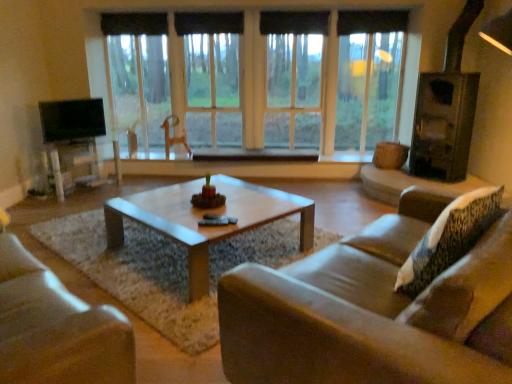
Question: Could you tell me if matte white entertainment center at left is facing leather couch at lower left, placed as the second studio couch when sorted from right to left?

Choices:
 (A) yes
 (B) no

Answer: (B)

Question: Can leather couch at lower left, the first studio couch viewed from the left, be found inside matte white entertainment center at left?

Choices:
 (A) yes
 (B) no

Answer: (B)

Question: Can you confirm if matte white entertainment center at left is thinner than leather couch at lower left, the first studio couch viewed from the left?

Choices:
 (A) yes
 (B) no

Answer: (B)

Question: Does matte white entertainment center at left have a smaller size compared to leather couch at lower left, the first studio couch viewed from the left?

Choices:
 (A) no
 (B) yes

Answer: (B)

Question: Can you confirm if matte white entertainment center at left is bigger than leather couch at lower left, placed as the second studio couch when sorted from right to left?

Choices:
 (A) no
 (B) yes

Answer: (A)

Question: Based on their sizes in the image, would you say transparent glass window at center is bigger or smaller than brown leather couch at center, which appears as the first studio couch when viewed from the right?

Choices:
 (A) big
 (B) small

Answer: (B)

Question: Choose the correct answer: Is transparent glass window at center inside brown leather couch at center, positioned as the 2th studio couch in left-to-right order, or outside it?

Choices:
 (A) inside
 (B) outside

Answer: (B)

Question: Relative to brown leather couch at center, positioned as the 2th studio couch in left-to-right order, is transparent glass window at center in front or behind?

Choices:
 (A) front
 (B) behind

Answer: (B)

Question: Considering the positions of point (253, 59) and point (303, 304), is point (253, 59) closer or farther from the camera than point (303, 304)?

Choices:
 (A) farther
 (B) closer

Answer: (A)

Question: Based on their sizes in the image, would you say brown leather couch at center, which appears as the first studio couch when viewed from the right, is bigger or smaller than black fabric curtain at upper center, the second curtain in the right-to-left sequence?

Choices:
 (A) big
 (B) small

Answer: (A)

Question: Choose the correct answer: Is brown leather couch at center, which appears as the first studio couch when viewed from the right, inside black fabric curtain at upper center, the 2th curtain when ordered from left to right, or outside it?

Choices:
 (A) outside
 (B) inside

Answer: (A)

Question: Does point (384, 350) appear closer or farther from the camera than point (198, 13)?

Choices:
 (A) farther
 (B) closer

Answer: (B)

Question: From the image's perspective, is brown leather couch at center, positioned as the 2th studio couch in left-to-right order, positioned above or below black fabric curtain at upper center, the second curtain in the right-to-left sequence?

Choices:
 (A) above
 (B) below

Answer: (B)

Question: From a real-world perspective, is black fabric curtain at upper center, the first curtain when ordered from right to left, above or below matte white entertainment center at left?

Choices:
 (A) above
 (B) below

Answer: (A)

Question: Considering the positions of point (265, 13) and point (57, 183), is point (265, 13) closer or farther from the camera than point (57, 183)?

Choices:
 (A) closer
 (B) farther

Answer: (B)